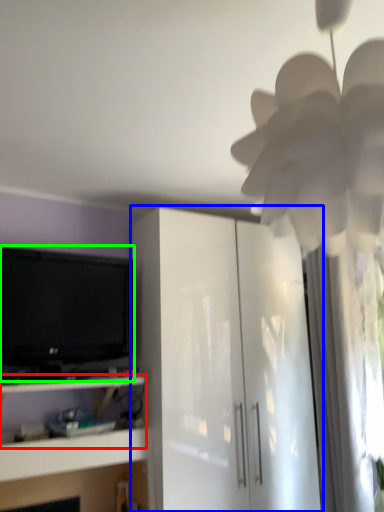
Question: Based on their relative distances, which object is farther from shelf (highlighted by a red box)? Choose from cabinetry (highlighted by a blue box) and television (highlighted by a green box).

Choices:
 (A) cabinetry
 (B) television

Answer: (A)